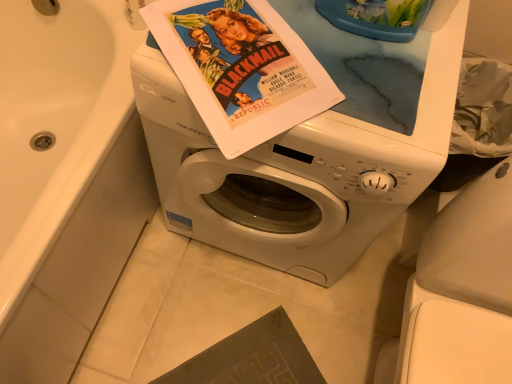
The image size is (512, 384). Find the location of `vacant area on top of matte paper movie poster at center (from a real-world perspective)`. vacant area on top of matte paper movie poster at center (from a real-world perspective) is located at coordinates (247, 36).